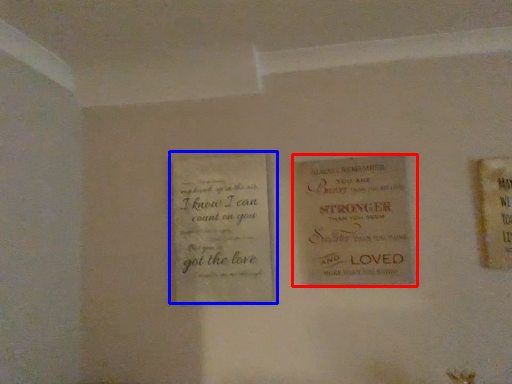
Question: Which object is further to the camera taking this photo, book (highlighted by a red box) or book (highlighted by a blue box)?

Choices:
 (A) book
 (B) book

Answer: (B)